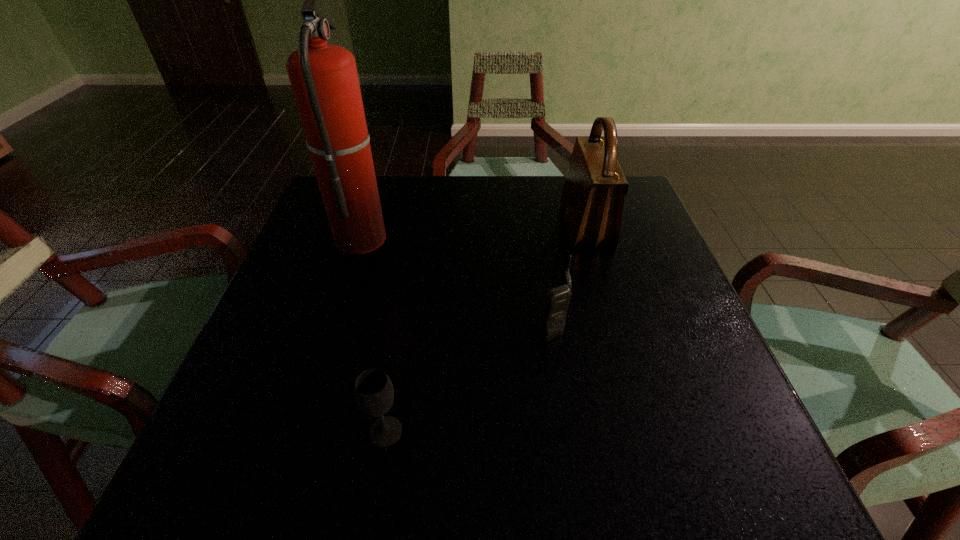
Point out which object is positioned as the third nearest to the nearest object. Please provide its 2D coordinates. Your answer should be formatted as a tuple, i.e. [(x, y)], where the tuple contains the x and y coordinates of a point satisfying the conditions above.

[(592, 200)]

This screenshot has width=960, height=540. Find the location of `vacant space that satisfies the following two spatial constraints: 1. with the nozzle and gauge on the wineglass; 2. on the left side of the fire extinguisher`. vacant space that satisfies the following two spatial constraints: 1. with the nozzle and gauge on the wineglass; 2. on the left side of the fire extinguisher is located at coordinates (299, 431).

Locate an element on the screen. vacant area that satisfies the following two spatial constraints: 1. with the nozzle and gauge on the fire extinguisher; 2. on the right side of the wineglass is located at coordinates (299, 431).

Locate an element on the screen. The height and width of the screenshot is (540, 960). free location that satisfies the following two spatial constraints: 1. on the front flap of the rightmost object; 2. on the front side of the second object from left to right is located at coordinates (646, 431).